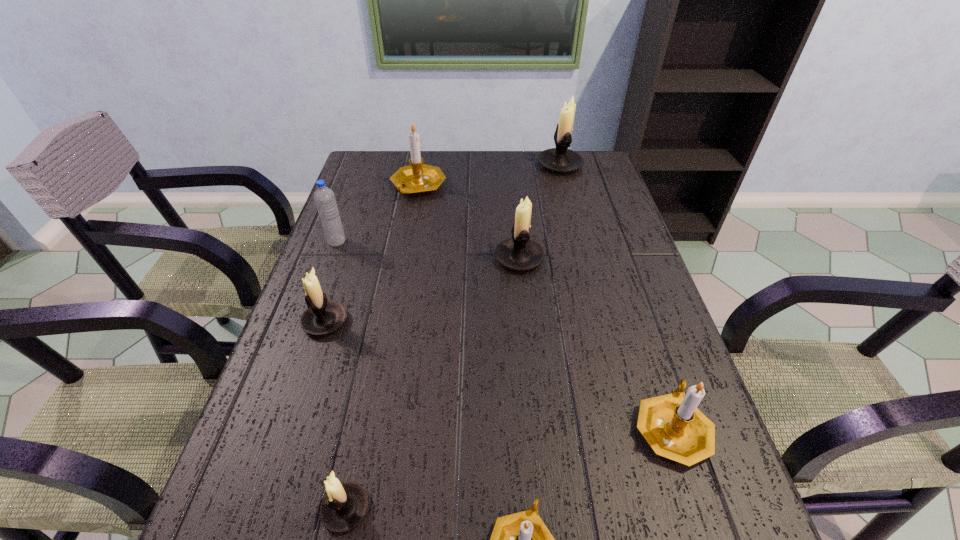
The width and height of the screenshot is (960, 540). I want to click on free space between the fifth farthest candle holder and the fifth farthest object, so click(x=498, y=375).

Image resolution: width=960 pixels, height=540 pixels. Identify the location of free space that is in between the tallest object and the sixth farthest object. (616, 296).

Locate an element on the screen. The image size is (960, 540). vacant space that is in between the rightmost gold candle holder and the third farthest white candle holder is located at coordinates (498, 375).

This screenshot has width=960, height=540. I want to click on vacant point located between the farthest gold candle holder and the fourth nearest candle holder, so click(x=372, y=254).

Image resolution: width=960 pixels, height=540 pixels. In order to click on empty location between the blue water bottle and the fifth farthest object in this screenshot , I will do `click(331, 281)`.

Find the location of a particular element. free space between the nearest white candle holder and the water bottle is located at coordinates (342, 375).

Where is `object that stands as the sixth closest to the third biggest white candle holder`? object that stands as the sixth closest to the third biggest white candle holder is located at coordinates (672, 425).

In order to click on the closest object relative to the blue water bottle in this screenshot , I will do `click(417, 178)`.

Locate an element on the screen. candle holder that is the fifth nearest to the smallest white candle holder is located at coordinates (417, 178).

Select which candle holder is the closest to the tallest candle holder. Please provide its 2D coordinates. Your answer should be formatted as a tuple, i.e. [(x, y)], where the tuple contains the x and y coordinates of a point satisfying the conditions above.

[(417, 178)]